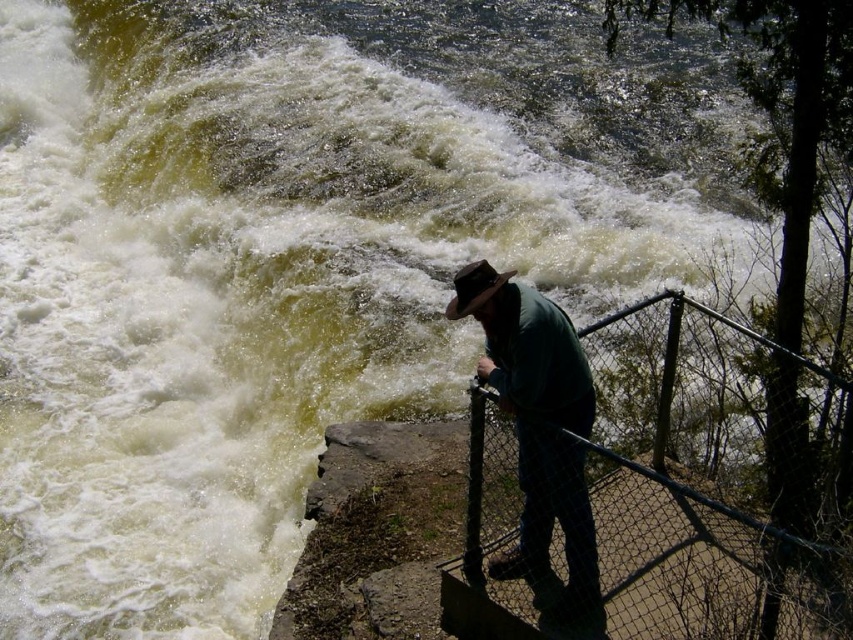
The image size is (853, 640). What do you see at coordinates (708, 481) in the screenshot?
I see `black wire mesh fence at lower right` at bounding box center [708, 481].

Which is more to the left, black wire mesh fence at lower right or green matte shirt at center?

From the viewer's perspective, green matte shirt at center appears more on the left side.

The height and width of the screenshot is (640, 853). In order to click on black wire mesh fence at lower right in this screenshot , I will do `click(708, 481)`.